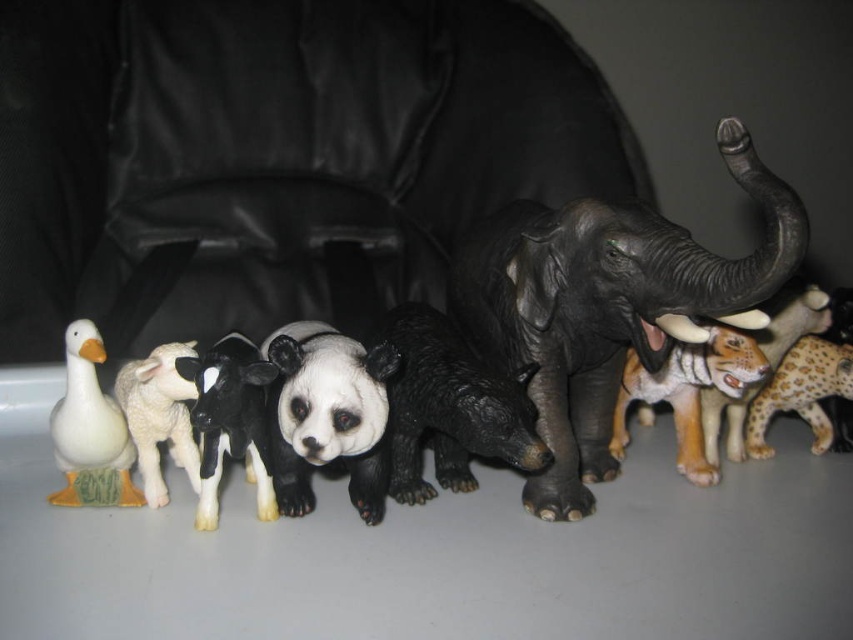
Question: Is black matte bear at center smaller than white glossy duck at left?

Choices:
 (A) yes
 (B) no

Answer: (B)

Question: Is the position of black matte bear at center less distant than that of white glossy duck at left?

Choices:
 (A) no
 (B) yes

Answer: (B)

Question: Which point is closer to the camera?

Choices:
 (A) white woolen sheep at left
 (B) orange-brown plastic tiger at center-right
 (C) black rubber elephant at center
 (D) black matte/painted panda at center

Answer: (C)

Question: Which point appears farthest from the camera in this image?

Choices:
 (A) (782, 385)
 (B) (671, 321)
 (C) (357, 403)

Answer: (A)

Question: Which point is farther to the camera?

Choices:
 (A) black matte panda at center
 (B) black matte/painted panda at center

Answer: (A)

Question: Does white glossy duck at left lie in front of spotted fur leopard at right?

Choices:
 (A) yes
 (B) no

Answer: (A)